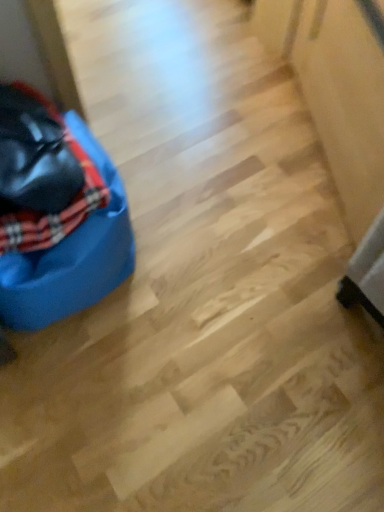
Find the location of `free space in front of blue fabric bean bag at left`. free space in front of blue fabric bean bag at left is located at coordinates pos(91,391).